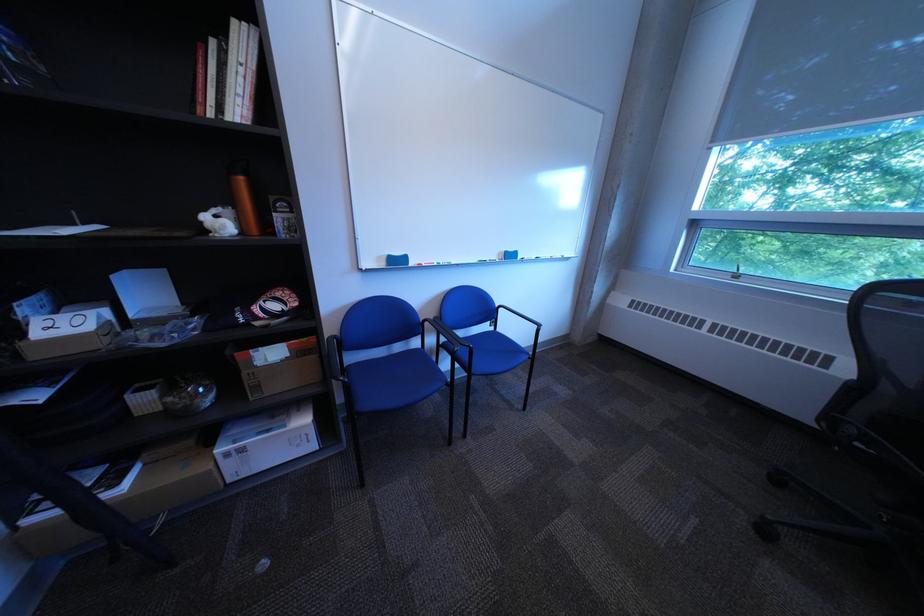
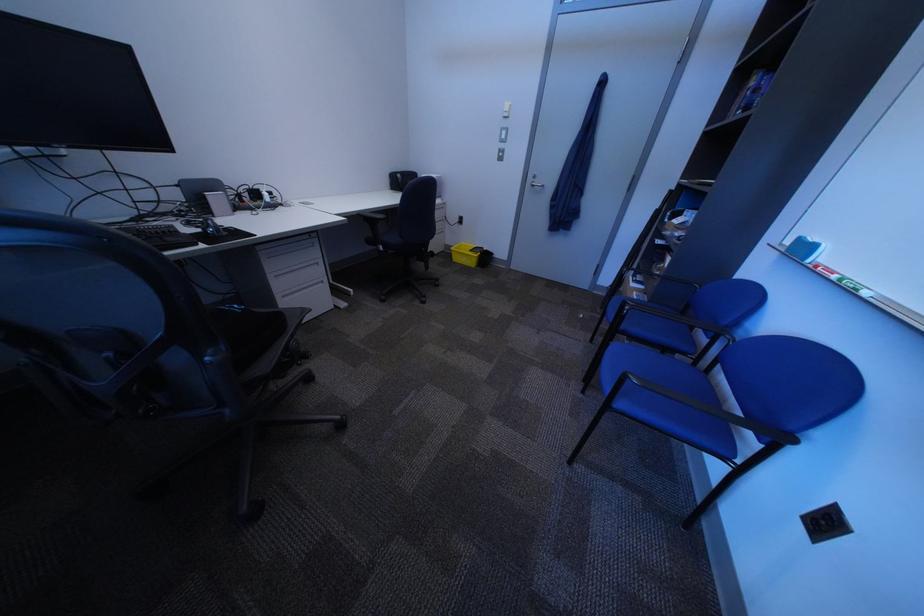
Find the pixel in the second image that matches (451,265) in the first image.

(849, 278)